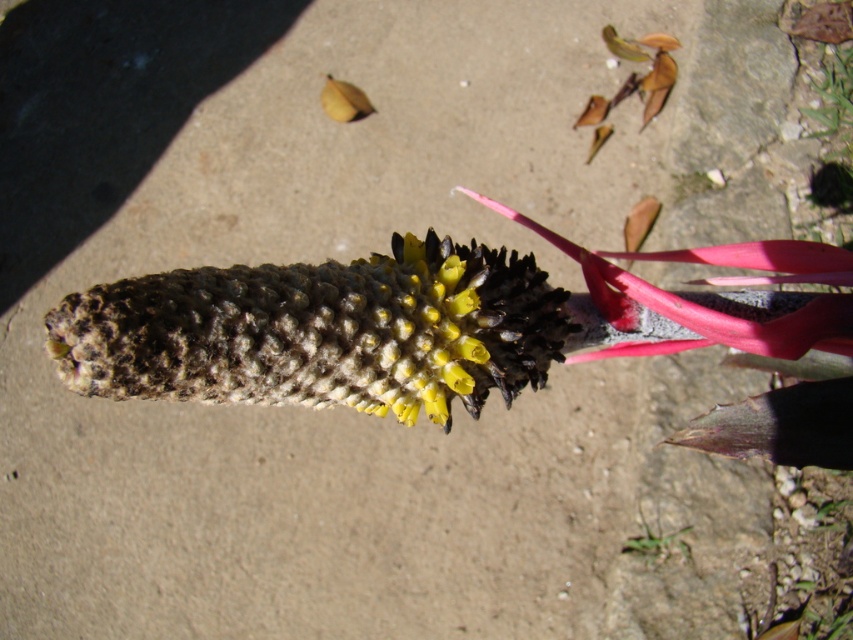
Question: Is the position of leathery brown flower at center less distant than that of green textured leaf at lower right?

Choices:
 (A) no
 (B) yes

Answer: (B)

Question: Is the position of leathery brown flower at center less distant than that of green textured leaf at lower right?

Choices:
 (A) no
 (B) yes

Answer: (B)

Question: Observing the image, what is the correct spatial positioning of leathery brown flower at center in reference to green textured leaf at lower right?

Choices:
 (A) left
 (B) right

Answer: (A)

Question: Which object appears farthest from the camera in this image?

Choices:
 (A) leathery brown flower at center
 (B) green textured leaf at lower right

Answer: (B)